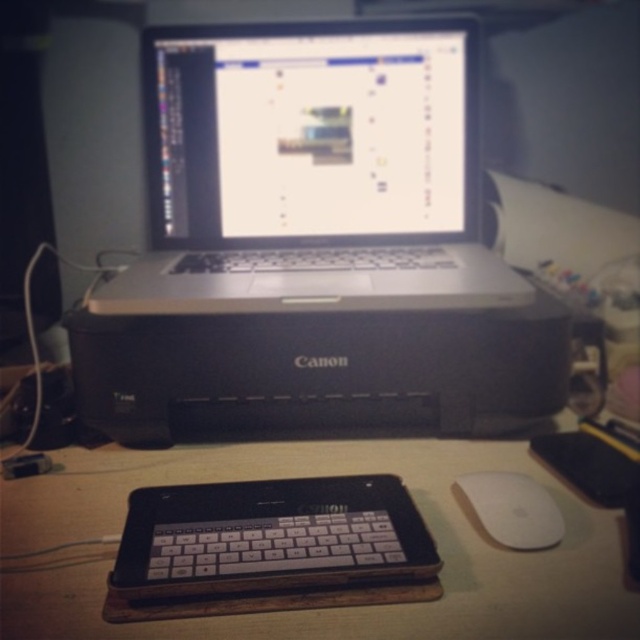
You are organizing your desk and want to place a new wireless charger between the matte silver laptop at center and the white matte mouse at lower right. Based on their positions, where should you place the wireless charger?

Since the matte silver laptop at center is located above the white matte mouse at lower right, you should place the wireless charger between them either below the laptop or above the mouse, depending on the available space.